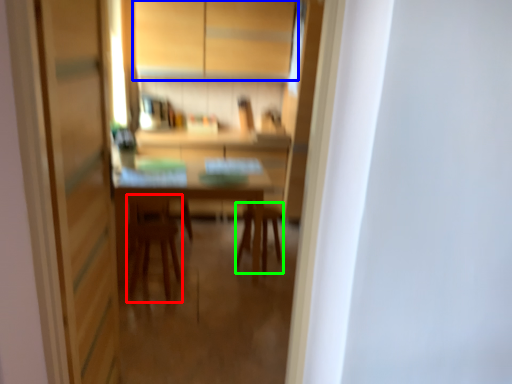
Question: Estimate the real-world distances between objects in this image. Which object is closer to armchair (highlighted by a red box), cabinetry (highlighted by a blue box) or chair (highlighted by a green box)?

Choices:
 (A) cabinetry
 (B) chair

Answer: (B)